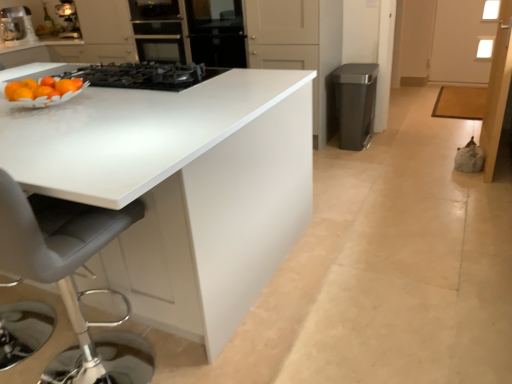
Question: Is metallic silver coffee maker at upper left wider or thinner than white glossy table at center?

Choices:
 (A) thin
 (B) wide

Answer: (A)

Question: Considering the positions of metallic silver coffee maker at upper left and white glossy table at center in the image, is metallic silver coffee maker at upper left bigger or smaller than white glossy table at center?

Choices:
 (A) big
 (B) small

Answer: (B)

Question: Estimate the real-world distances between objects in this image. Which object is closer to the metallic silver coffee maker at upper left?

Choices:
 (A) white glossy table at center
 (B) black matte gas stove at upper center
 (C) black glass oven at center
 (D) gray leather swivel chair at left
 (E) satin metallic trash can at right

Answer: (C)

Question: Considering the real-world distances, which object is closest to the black glass oven at center?

Choices:
 (A) satin metallic trash can at right
 (B) white glossy table at center
 (C) black matte gas stove at upper center
 (D) gray leather swivel chair at left
 (E) metallic silver coffee maker at upper left

Answer: (C)